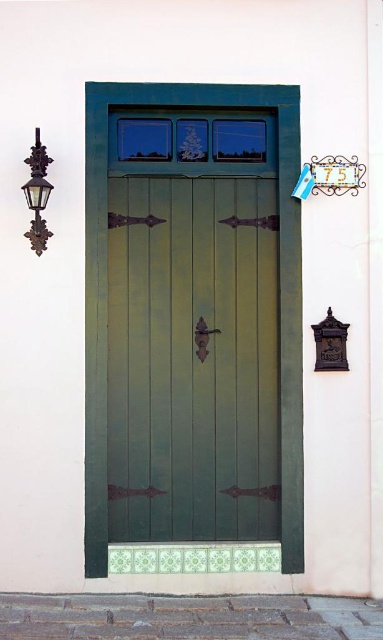
Between green painted wood door at center and matte black lantern at left, which one appears on the left side from the viewer's perspective?

From the viewer's perspective, matte black lantern at left appears more on the left side.

Locate an element on the screen. green painted wood door at center is located at coordinates (106, 300).